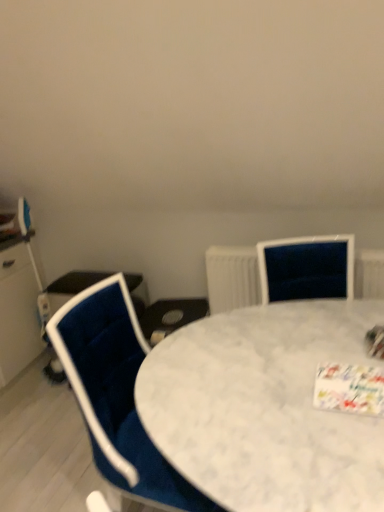
Measure the distance between point (205,329) and camera.

They are 1.51 meters apart.

Locate an element on the screen. white textured radiator at upper right is located at coordinates (232, 277).

Does point (213, 308) come farther from viewer compared to point (322, 488)?

Yes, it is behind point (322, 488).

Is white textured radiator at upper right facing towards white marble table at center?

Yes, white textured radiator at upper right is turned towards white marble table at center.

From a real-world perspective, which object stands above the other?

white textured radiator at upper right is physically above.

Considering the positions of objects white textured radiator at upper right and white marble table at center in the image provided, who is behind, white textured radiator at upper right or white marble table at center?

white textured radiator at upper right is more distant.

Does white marble table at center appear on the right side of white textured radiator at upper right?

In fact, white marble table at center is to the left of white textured radiator at upper right.

Which object is closer to the camera taking this photo, white marble table at center or white textured radiator at upper right?

Positioned in front is white marble table at center.

From the image's perspective, which is above, white marble table at center or white textured radiator at upper right?

white textured radiator at upper right, from the image's perspective.

Could you tell me if white marble table at center is turned towards white textured radiator at upper right?

No, white marble table at center is not facing towards white textured radiator at upper right.

This screenshot has height=512, width=384. I want to click on chair behind the white marble table at center, so click(x=116, y=394).

Is white marble table at center facing away from velvet blue chair at left?

Yes, velvet blue chair at left is at the back of white marble table at center.

Considering the relative positions of white marble table at center and velvet blue chair at left in the image provided, is white marble table at center to the left or to the right of velvet blue chair at left?

Based on their positions, white marble table at center is located to the right of velvet blue chair at left.

Considering the sizes of objects white marble table at center and velvet blue chair at left in the image provided, who is smaller, white marble table at center or velvet blue chair at left?

velvet blue chair at left is smaller.

Can you tell me how much velvet blue chair at left and white textured radiator at upper right differ in facing direction?

They differ by 91.9 degrees in their facing directions.

Is point (113, 333) positioned behind point (235, 307)?

No.

Identify the location of chair on the left of white textured radiator at upper right. (116, 394).

From the image's perspective, which one is positioned lower, velvet blue chair at left or white textured radiator at upper right?

velvet blue chair at left.

Which is farther, (109, 480) or (292, 481)?

Positioned behind is point (109, 480).

Who is more distant, velvet blue chair at left or white marble table at center?

velvet blue chair at left is more distant.

From the image's perspective, is velvet blue chair at left under white marble table at center?

Actually, velvet blue chair at left appears above white marble table at center in the image.

Is white marble table at center at the back of velvet blue chair at left?

Absolutely, velvet blue chair at left is directed away from white marble table at center.

Would you say white textured radiator at upper right is inside or outside velvet blue chair at left?

white textured radiator at upper right is not enclosed by velvet blue chair at left.

Does point (233, 300) come farther from viewer compared to point (70, 338)?

Yes, point (233, 300) is behind point (70, 338).

Considering the sizes of white textured radiator at upper right and velvet blue chair at left in the image, is white textured radiator at upper right bigger or smaller than velvet blue chair at left?

Clearly, white textured radiator at upper right is smaller in size than velvet blue chair at left.

Locate an element on the screen. This screenshot has width=384, height=512. table on the left of the white textured radiator at upper right is located at coordinates (265, 408).

The height and width of the screenshot is (512, 384). What are the coordinates of `table below the white textured radiator at upper right (from a real-world perspective)` in the screenshot? It's located at (265, 408).

Considering their positions, is velvet blue chair at left positioned closer to white textured radiator at upper right than white marble table at center?

The object closer to white textured radiator at upper right is white marble table at center.

Based on their spatial positions, is white textured radiator at upper right or velvet blue chair at left further from white marble table at center?

The object further to white marble table at center is white textured radiator at upper right.

Based on their spatial positions, is white marble table at center or white textured radiator at upper right further from velvet blue chair at left?

white textured radiator at upper right is positioned further to the anchor velvet blue chair at left.

Estimate the real-world distances between objects in this image. Which object is further from velvet blue chair at left, white textured radiator at upper right or white marble table at center?

Among the two, white textured radiator at upper right is located further to velvet blue chair at left.

Considering their positions, is velvet blue chair at left positioned further to white marble table at center than white textured radiator at upper right?

white textured radiator at upper right is further to white marble table at center.

Which object lies further to the anchor point white textured radiator at upper right, white marble table at center or velvet blue chair at left?

velvet blue chair at left.

Find the location of a particular element. The image size is (384, 512). chair positioned between white marble table at center and white textured radiator at upper right from near to far is located at coordinates (116, 394).